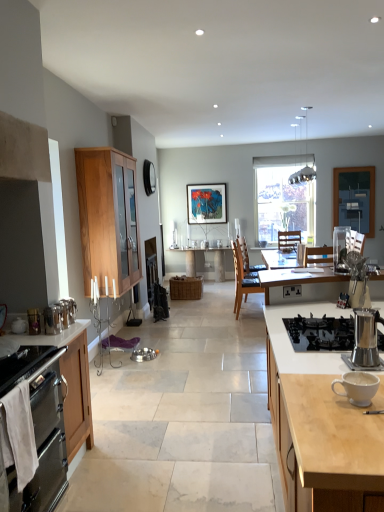
Question: From the image's perspective, is stainless steel espresso maker at right, arranged as the 1th appliance when viewed from the front, over white ceramic mug at right?

Choices:
 (A) no
 (B) yes

Answer: (B)

Question: From a real-world perspective, does stainless steel espresso maker at right, acting as the 2th appliance starting from the top, stand above white ceramic mug at right?

Choices:
 (A) yes
 (B) no

Answer: (A)

Question: Can you confirm if stainless steel espresso maker at right, the 5th appliance from the bottom, is positioned to the left of white ceramic mug at right?

Choices:
 (A) yes
 (B) no

Answer: (B)

Question: From a real-world perspective, is stainless steel espresso maker at right, which ranks as the 2th appliance in right-to-left order, located beneath white ceramic mug at right?

Choices:
 (A) yes
 (B) no

Answer: (B)

Question: Is stainless steel espresso maker at right, acting as the 2th appliance starting from the top, to the right of white ceramic mug at right from the viewer's perspective?

Choices:
 (A) no
 (B) yes

Answer: (B)

Question: Considering the relative sizes of stainless steel espresso maker at right, arranged as the 6th appliance when viewed from the back, and white ceramic mug at right in the image provided, is stainless steel espresso maker at right, arranged as the 6th appliance when viewed from the back, shorter than white ceramic mug at right?

Choices:
 (A) no
 (B) yes

Answer: (A)

Question: Would you say satin silver coffee maker at center-right, which appears as the 1th appliance when viewed from the right, is part of satin silver coffee pot at left, the third appliance in the back-to-front sequence,'s contents?

Choices:
 (A) no
 (B) yes

Answer: (A)

Question: From a real-world perspective, is satin silver coffee pot at left, the third appliance in the left-to-right sequence, under satin silver coffee maker at center-right, the first appliance from the top?

Choices:
 (A) yes
 (B) no

Answer: (A)

Question: Is satin silver coffee pot at left, which is counted as the 3th appliance, starting from the top, wider than satin silver coffee maker at center-right, which appears as the 2th appliance when viewed from the back?

Choices:
 (A) no
 (B) yes

Answer: (A)

Question: Is satin silver coffee pot at left, the third appliance in the back-to-front sequence, smaller than satin silver coffee maker at center-right, placed as the 6th appliance when sorted from bottom to top?

Choices:
 (A) no
 (B) yes

Answer: (B)

Question: From a real-world perspective, is satin silver coffee pot at left, arranged as the 4th appliance when ordered from the bottom, located higher than satin silver coffee maker at center-right, placed as the 6th appliance when sorted from bottom to top?

Choices:
 (A) no
 (B) yes

Answer: (A)

Question: From the image's perspective, does satin silver coffee pot at left, the 4th appliance positioned from the right, appear higher than satin silver coffee maker at center-right, placed as the 6th appliance when sorted from bottom to top?

Choices:
 (A) no
 (B) yes

Answer: (A)

Question: Is matte wooden picture frame at center further to camera compared to metallic silver kettle at left, which appears as the sixth appliance when viewed from the right?

Choices:
 (A) no
 (B) yes

Answer: (B)